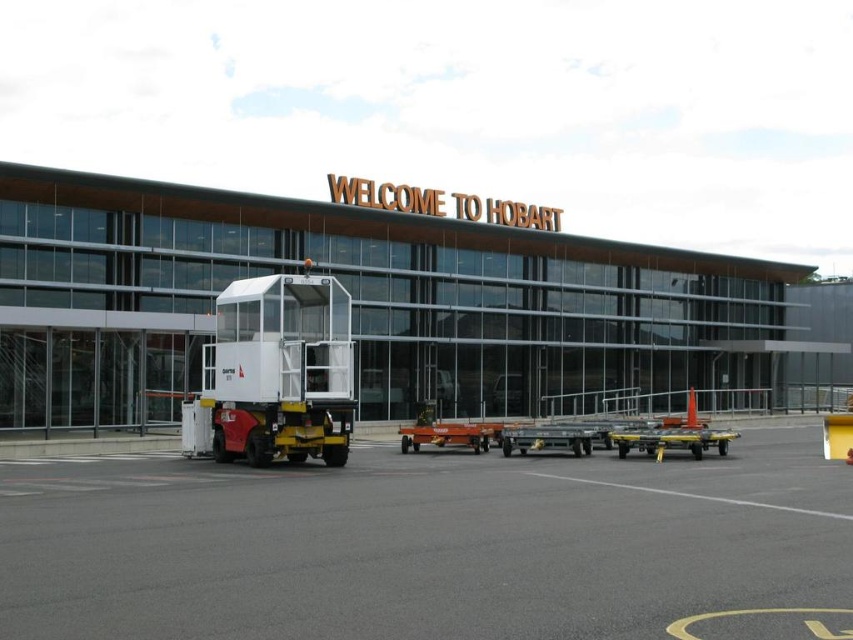
You are standing at the entrance of Hobart Airport, where the large illuminated sign says WELCOME TO HOBART. You want to take a photo of the sign from a distance of 24.40 feet. Is there an exact spot marked by a point at coordinates (331, 570) that you can stand on to achieve this?

Yes, the point at coordinates (331, 570) is exactly 24.40 feet away from the viewer, so standing there would allow you to take the photo from the desired distance.

You are a delivery driver arriving at Hobart Airport and need to park your truck. The parking area is the gray asphalt tarmac at center. There is a white plastic truck at center already parked there. Can your truck fit alongside the existing truck within the parking area?

The gray asphalt tarmac at center is wider than the white plastic truck at center, so your truck can fit alongside the existing white plastic truck at center within the parking area.